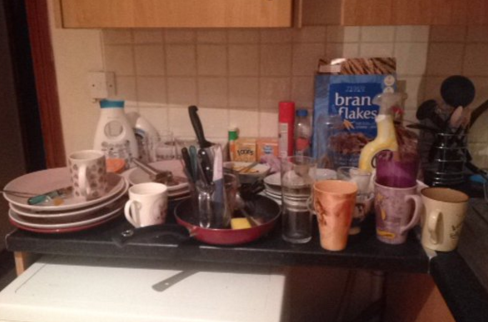
Find the location of a particular element. The width and height of the screenshot is (488, 322). door trim is located at coordinates pos(49,118).